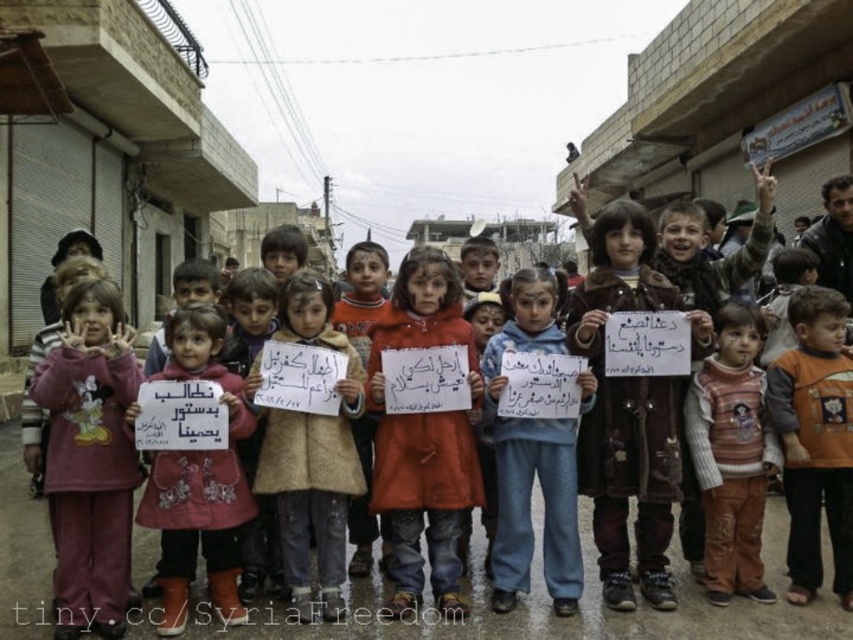
Question: Which point is closer to the camera taking this photo?

Choices:
 (A) (344, 440)
 (B) (79, 449)
 (C) (279, 620)

Answer: (B)

Question: Does denim jeans at center lie in front of orange fabric shirt at center?

Choices:
 (A) yes
 (B) no

Answer: (B)

Question: Among these objects, which one is farthest from the camera?

Choices:
 (A) orange fabric shirt at center
 (B) matte pink coat at center

Answer: (A)

Question: Considering the real-world distances, which object is farthest from the striped sweater at center?

Choices:
 (A) orange fabric shirt at center
 (B) denim jeans at center

Answer: (B)

Question: Considering the relative positions of maroon fleece sweatshirt at left and matte pink coat at center in the image provided, where is maroon fleece sweatshirt at left located with respect to matte pink coat at center?

Choices:
 (A) below
 (B) above

Answer: (B)

Question: Is denim jeans at center below orange fabric shirt at center?

Choices:
 (A) no
 (B) yes

Answer: (B)